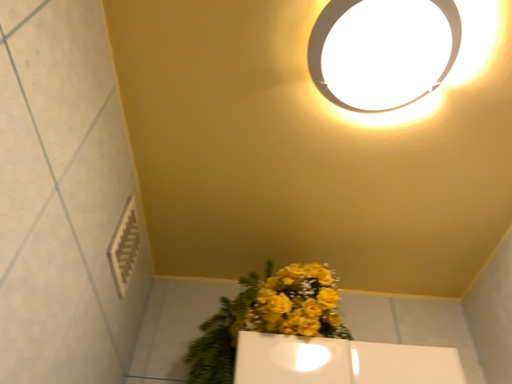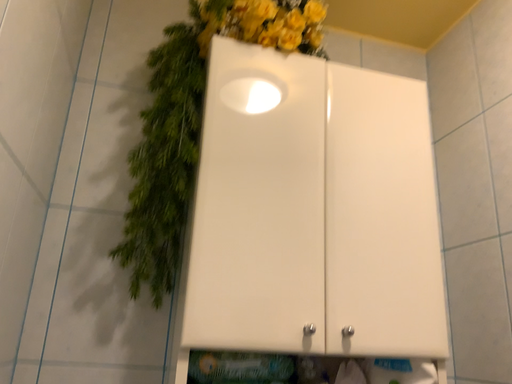
Question: Which way did the camera rotate in the video?

Choices:
 (A) rotated upward
 (B) rotated downward

Answer: (B)